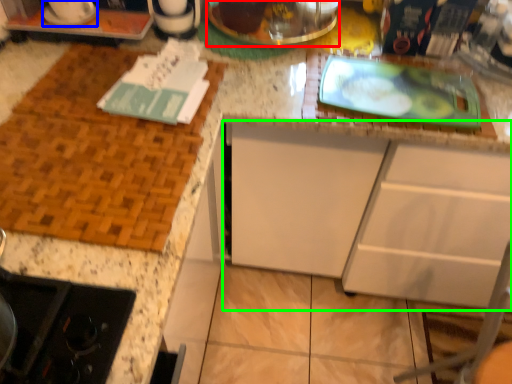
Question: Which object is positioned closest to appliance (highlighted by a red box)? Select from appliance (highlighted by a blue box) and cabinetry (highlighted by a green box).

Choices:
 (A) appliance
 (B) cabinetry

Answer: (A)